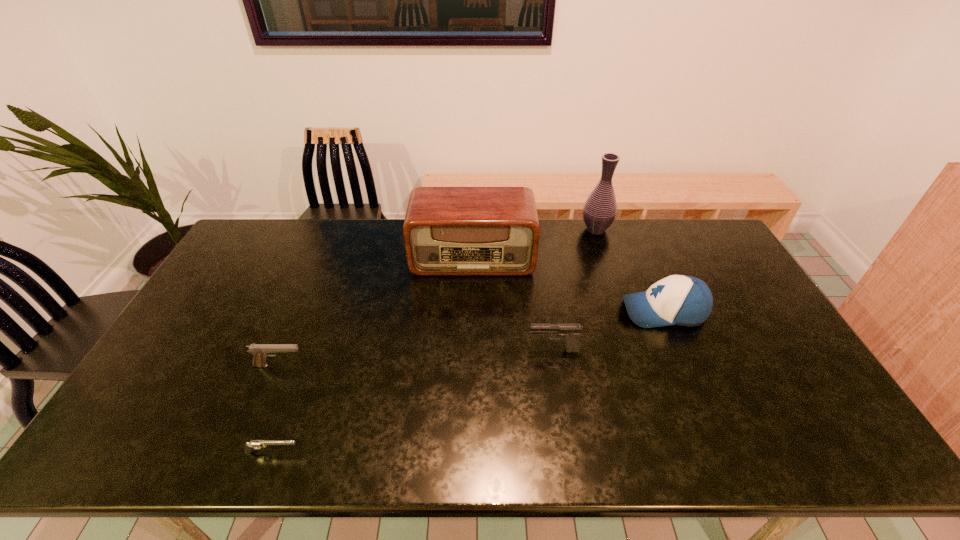
Image resolution: width=960 pixels, height=540 pixels. I want to click on the shortest pistol, so click(x=253, y=444).

At what (x,y) coordinates should I click in order to perform the action: click on the shortest object. Please return your answer as a coordinate pair (x, y). The image size is (960, 540). Looking at the image, I should click on (253, 444).

You are a GUI agent. You are given a task and a screenshot of the screen. Output one action in this format:
    pyautogui.click(x=<x>, y=<y>)
    Task: Click on the vacant region located 0.160m on the front of the tallest object
    The image size is (960, 540).
    Given the screenshot: What is the action you would take?
    (x=609, y=267)

The image size is (960, 540). Identify the location of vacant region located 0.200m on the front panel of the second tallest object. pos(471,321).

Image resolution: width=960 pixels, height=540 pixels. Find the location of `vacant point located on the front-facing side of the baseball cap`. vacant point located on the front-facing side of the baseball cap is located at coordinates (507, 312).

You are a GUI agent. You are given a task and a screenshot of the screen. Output one action in this format:
    pyautogui.click(x=<x>, y=<y>)
    Task: Click on the free space located on the front-facing side of the baseball cap
    This screenshot has height=540, width=960.
    Given the screenshot: What is the action you would take?
    pyautogui.click(x=523, y=312)

Image resolution: width=960 pixels, height=540 pixels. Find the location of `vacant space located on the front-facing side of the baseball cap`. vacant space located on the front-facing side of the baseball cap is located at coordinates (572, 312).

Image resolution: width=960 pixels, height=540 pixels. I want to click on vacant area situated aim along the barrel of the rightmost pistol, so click(445, 350).

The height and width of the screenshot is (540, 960). I want to click on vacant region located 0.220m aim along the barrel of the rightmost pistol, so click(449, 350).

Find the location of `vacant region located aim along the barrel of the rightmost pistol`. vacant region located aim along the barrel of the rightmost pistol is located at coordinates (467, 350).